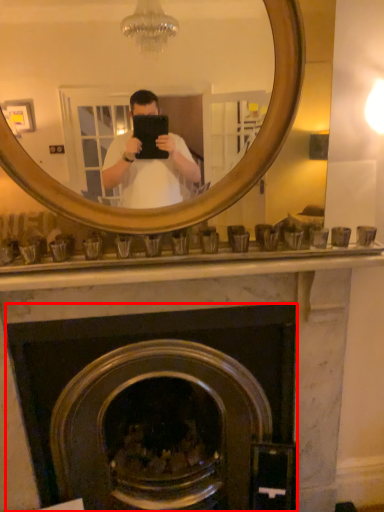
Question: From the image's perspective, what is the correct spatial relationship of fireplace (annotated by the red box) in relation to mirror?

Choices:
 (A) above
 (B) below

Answer: (B)